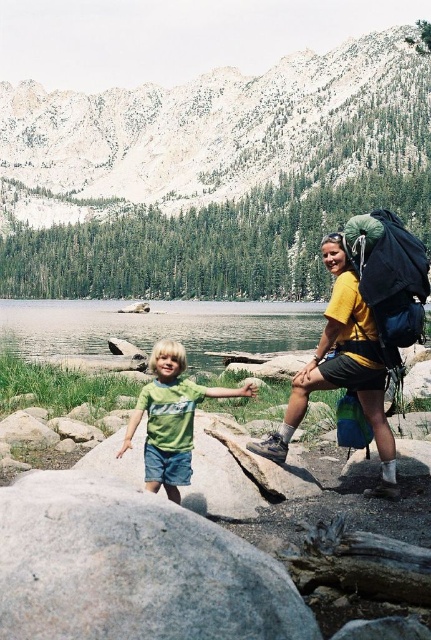
Question: Which point is farther from the camera taking this photo?

Choices:
 (A) (386, 435)
 (B) (200, 573)

Answer: (A)

Question: Does snowy granite mountain at upper center appear over gray rough boulder at lower left?

Choices:
 (A) no
 (B) yes

Answer: (B)

Question: Which point is farther to the camera?

Choices:
 (A) yellow matte backpack at right
 (B) gray rough boulder at lower left

Answer: (A)

Question: Is the position of snowy granite mountain at upper center less distant than that of gray rough boulder at lower left?

Choices:
 (A) yes
 (B) no

Answer: (B)

Question: Which point is farther from the camera taking this photo?

Choices:
 (A) (284, 68)
 (B) (327, 365)
 (C) (256, 554)
 (D) (143, 388)

Answer: (A)

Question: Does snowy granite mountain at upper center have a larger size compared to gray rough boulder at lower left?

Choices:
 (A) no
 (B) yes

Answer: (B)